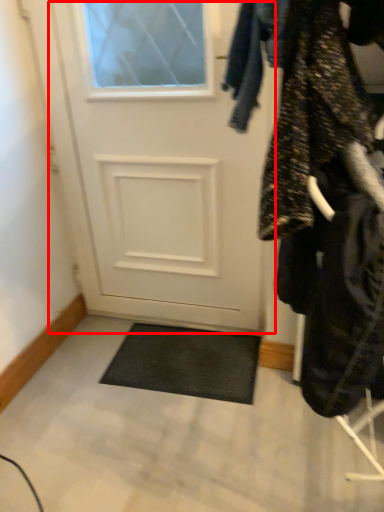
Question: Observing the image, what is the correct spatial positioning of door (annotated by the red box) in reference to closet?

Choices:
 (A) left
 (B) right

Answer: (A)